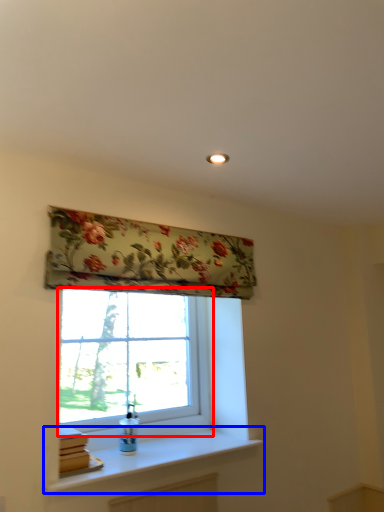
Question: Which of the following is the farthest to the observer, window (highlighted by a red box) or window sill (highlighted by a blue box)?

Choices:
 (A) window
 (B) window sill

Answer: (A)